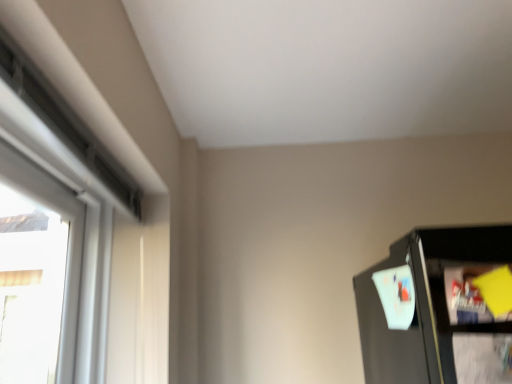
The image size is (512, 384). Find the location of `white matte window at upper left`. white matte window at upper left is located at coordinates (69, 184).

The image size is (512, 384). What do you see at coordinates (69, 184) in the screenshot? I see `white matte window at upper left` at bounding box center [69, 184].

Locate an element on the screen. Image resolution: width=512 pixels, height=384 pixels. white matte window at upper left is located at coordinates (69, 184).